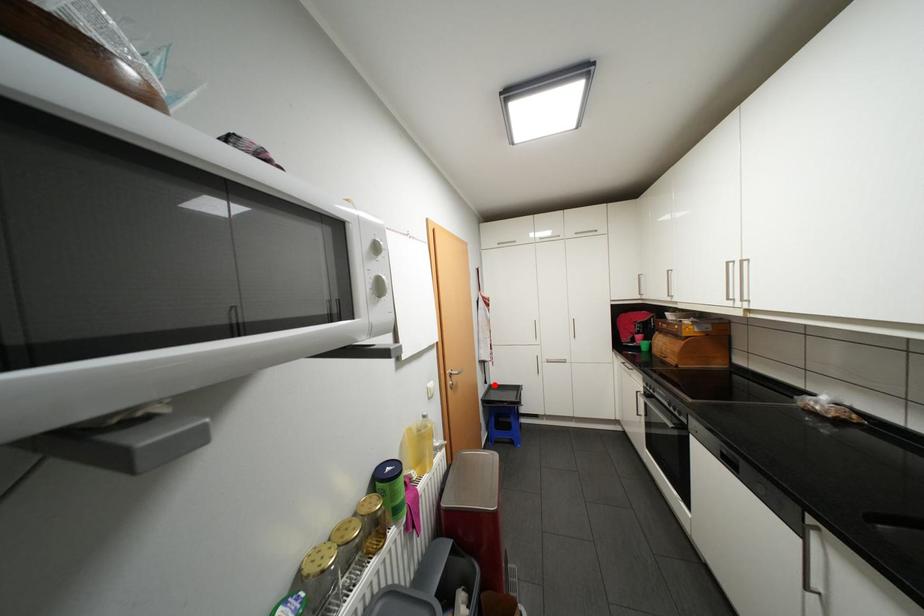
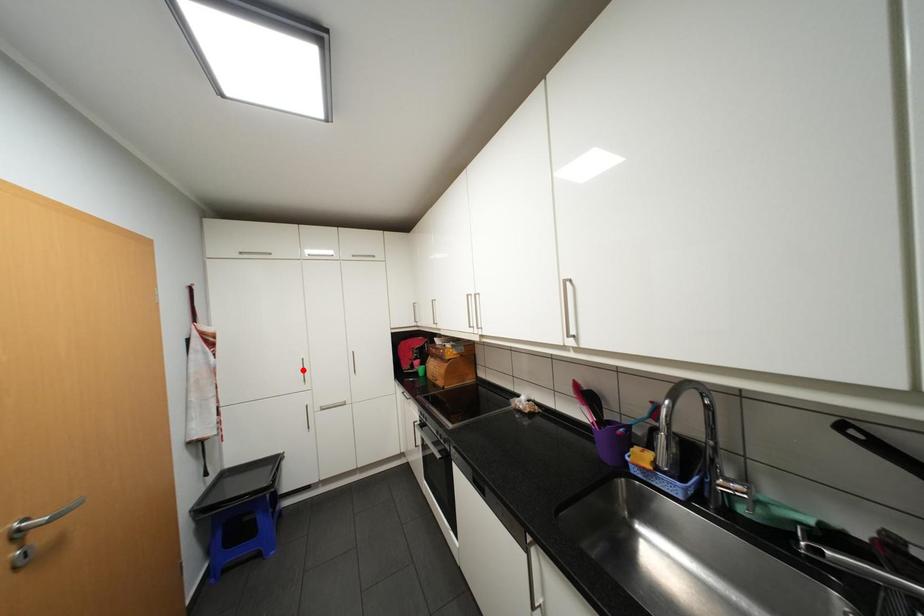
I am providing you with two images of the same scene from different viewpoints. A red point is marked on the first image and another point is marked on the second image. Is the red point in image1 aligned with the point shown in image2?

No